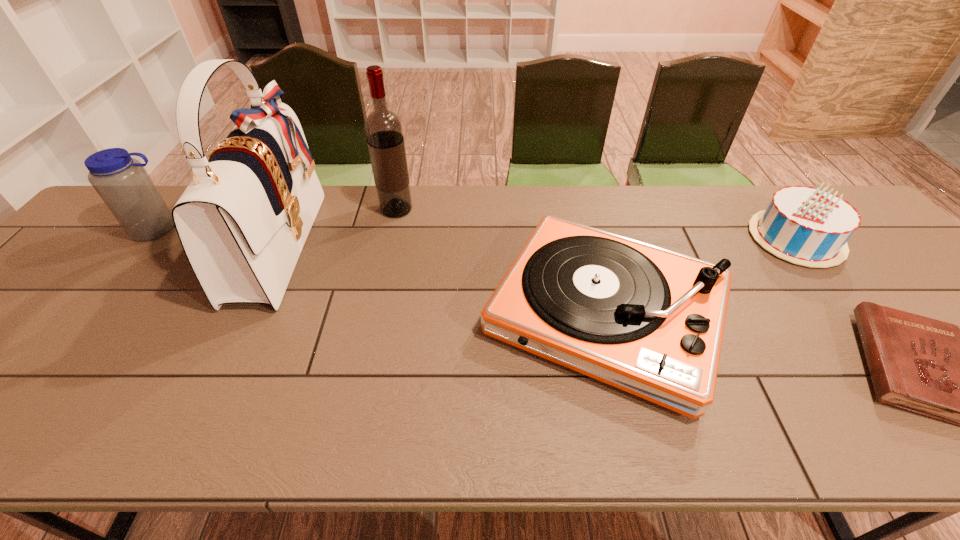
This screenshot has height=540, width=960. Find the location of `the fifth object from right to left`. the fifth object from right to left is located at coordinates (243, 220).

At what (x,y) coordinates should I click in order to perform the action: click on the fourth object from right to left. Please return your answer as a coordinate pair (x, y). Looking at the image, I should click on (383, 128).

Find the location of a particular element. the fifth shortest object is located at coordinates (383, 128).

Where is `the third tallest object`? The width and height of the screenshot is (960, 540). the third tallest object is located at coordinates (122, 182).

Find the location of `water bottle`. water bottle is located at coordinates (122, 182).

This screenshot has height=540, width=960. I want to click on birthday cake, so click(x=806, y=226).

I want to click on record player, so click(649, 321).

The height and width of the screenshot is (540, 960). What are the coordinates of `blank space located 0.090m on the front-facing side of the satchel` in the screenshot? It's located at (345, 244).

The height and width of the screenshot is (540, 960). I want to click on free location located on the right of the fifth shortest object, so click(x=492, y=210).

Locate an element on the screen. This screenshot has width=960, height=540. free point located with a carrying loop on the side of the fourth shortest object is located at coordinates (101, 303).